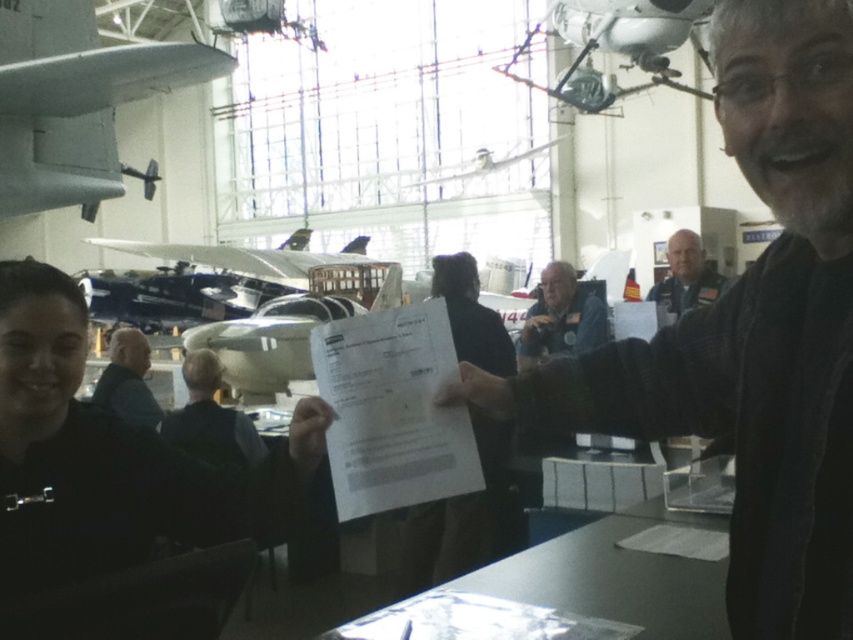
Question: Which point is closer to the camera?

Choices:
 (A) dark gray fabric jacket at left
 (B) dark blue uniform at center

Answer: (B)

Question: Can you confirm if dark gray sweater at center is positioned to the left of gray fabric jacket at center?

Choices:
 (A) no
 (B) yes

Answer: (B)

Question: Does dark gray sweater at center appear on the right side of white matte airplane at upper center?

Choices:
 (A) yes
 (B) no

Answer: (B)

Question: Is white paper at center below gray fabric jacket at center?

Choices:
 (A) yes
 (B) no

Answer: (A)

Question: Which object is positioned closest to the white matte airplane at upper center?

Choices:
 (A) metallic silver airplane at upper center
 (B) dark blue uniform at center
 (C) dark gray sweater at center

Answer: (A)

Question: Which point appears farthest from the camera in this image?

Choices:
 (A) (572, 308)
 (B) (111, 339)
 (C) (700, 300)
 (D) (489, 452)

Answer: (B)